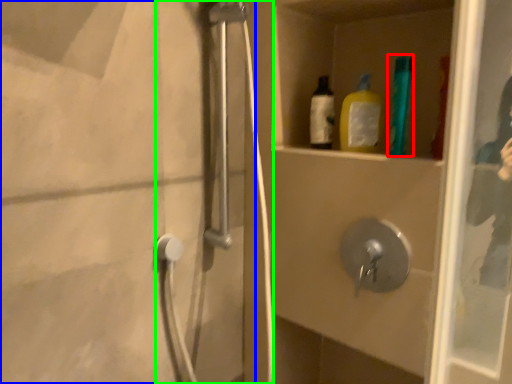
Question: Which object is the farthest from bottle (highlighted by a red box)? Choose among these: screen door (highlighted by a blue box) or shower door (highlighted by a green box).

Choices:
 (A) screen door
 (B) shower door

Answer: (A)